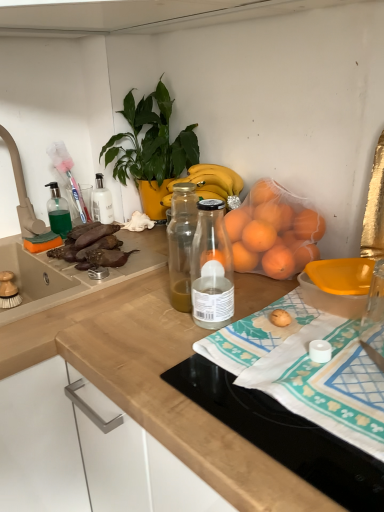
Question: Is brown matte eggplant at left oriented away from wooden at upper right, the 1th countertop when ordered from right to left?

Choices:
 (A) no
 (B) yes

Answer: (A)

Question: Does brown matte eggplant at left appear on the right side of wooden at upper right, the 1th countertop when ordered from right to left?

Choices:
 (A) yes
 (B) no

Answer: (B)

Question: Is brown matte eggplant at left oriented towards wooden at upper right, positioned as the second countertop in left-to-right order?

Choices:
 (A) no
 (B) yes

Answer: (B)

Question: From the image's perspective, is brown matte eggplant at left located above wooden at upper right, the 1th countertop when ordered from right to left?

Choices:
 (A) no
 (B) yes

Answer: (B)

Question: Is brown matte eggplant at left closer to camera compared to wooden at upper right, positioned as the second countertop in left-to-right order?

Choices:
 (A) no
 (B) yes

Answer: (A)

Question: From a real-world perspective, is brown matte eggplant at left physically above wooden at upper right, the 1th countertop when ordered from right to left?

Choices:
 (A) no
 (B) yes

Answer: (B)

Question: From a real-world perspective, is green glossy plant at upper center located beneath wooden at upper right, positioned as the second countertop in left-to-right order?

Choices:
 (A) no
 (B) yes

Answer: (A)

Question: Does green glossy plant at upper center have a greater width compared to wooden at upper right, positioned as the second countertop in left-to-right order?

Choices:
 (A) yes
 (B) no

Answer: (B)

Question: Is green glossy plant at upper center completely or partially outside of wooden at upper right, positioned as the second countertop in left-to-right order?

Choices:
 (A) no
 (B) yes

Answer: (B)

Question: Can you confirm if green glossy plant at upper center is bigger than wooden at upper right, positioned as the second countertop in left-to-right order?

Choices:
 (A) yes
 (B) no

Answer: (A)

Question: Is green glossy plant at upper center at the right side of wooden at upper right, the 1th countertop when ordered from right to left?

Choices:
 (A) no
 (B) yes

Answer: (A)

Question: From the image's perspective, is green glossy plant at upper center above wooden at upper right, positioned as the second countertop in left-to-right order?

Choices:
 (A) no
 (B) yes

Answer: (B)

Question: Does brown matte eggplant at left have a lesser height compared to wooden at center, the first countertop when ordered from left to right?

Choices:
 (A) yes
 (B) no

Answer: (A)